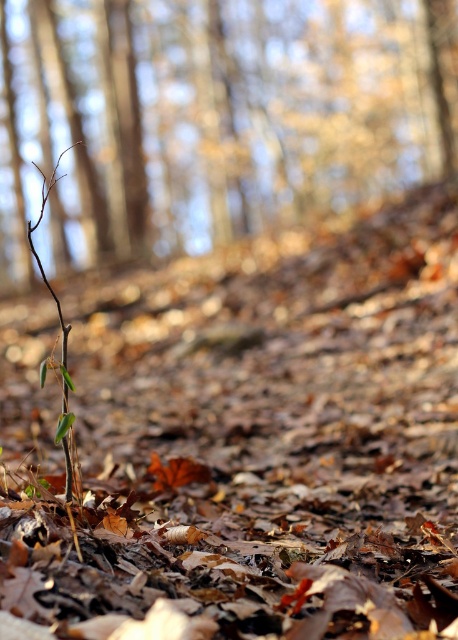
Which of these two, brown dry leaves at center or brown matte branch at left, stands taller?

Standing taller between the two is brown matte branch at left.

Is brown dry leaves at center wider than brown matte branch at left?

In fact, brown dry leaves at center might be narrower than brown matte branch at left.

Between point (447, 506) and point (419, 124), which one is positioned behind?

Point (419, 124)

Locate an element on the screen. brown dry leaves at center is located at coordinates (243, 444).